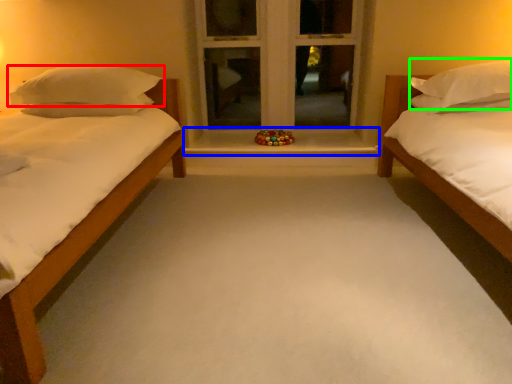
Question: Considering the real-world distances, which object is closest to pillow (highlighted by a red box)? window sill (highlighted by a blue box) or pillow (highlighted by a green box).

Choices:
 (A) window sill
 (B) pillow

Answer: (A)